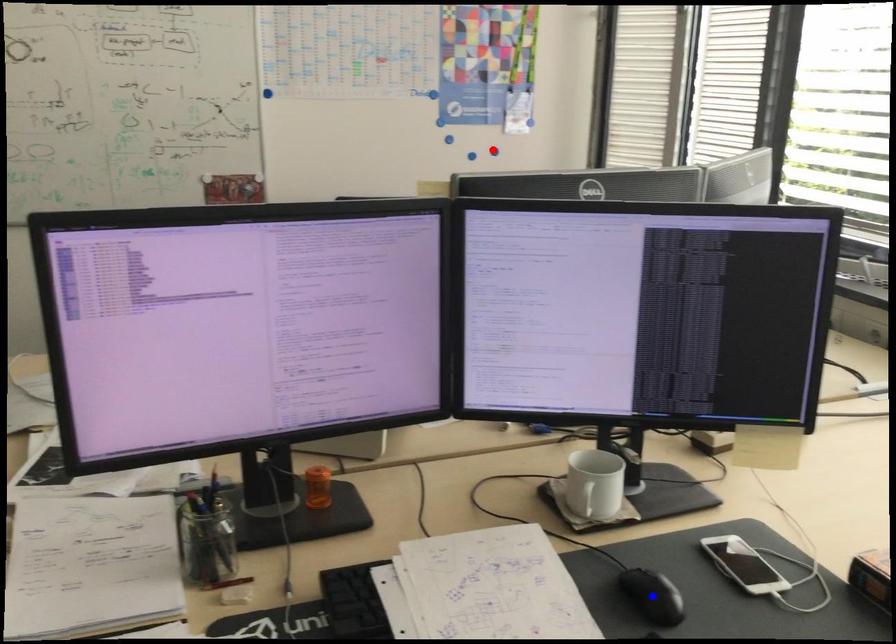
Question: Which of the two points in the image is closer to the camera?

Choices:
 (A) Blue point is closer.
 (B) Red point is closer.

Answer: (A)